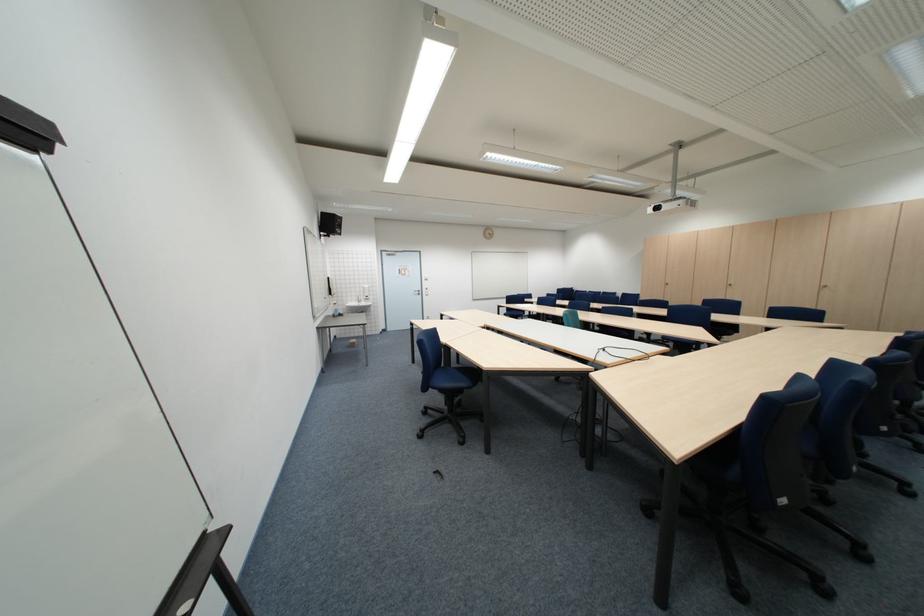
Where is `blue chair sitting surface`? blue chair sitting surface is located at coordinates (454, 378).